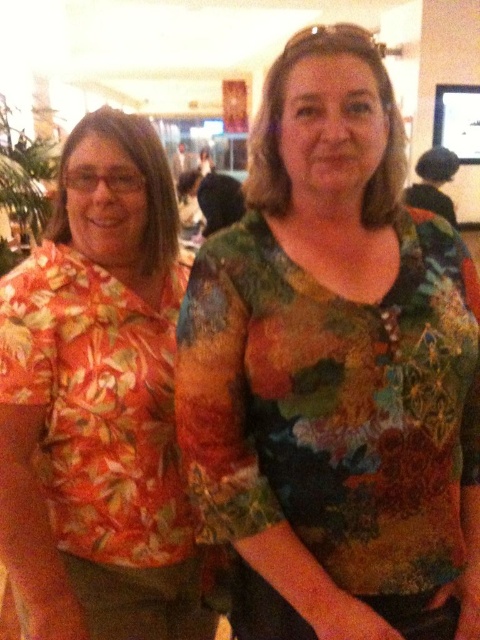
Question: Does floral fabric blouse at center come behind orange floral shirt at left?

Choices:
 (A) no
 (B) yes

Answer: (A)

Question: Is floral fabric blouse at center closer to camera compared to orange floral shirt at left?

Choices:
 (A) no
 (B) yes

Answer: (B)

Question: Among these objects, which one is farthest from the camera?

Choices:
 (A) floral fabric blouse at center
 (B) orange floral shirt at left

Answer: (B)

Question: Which point is closer to the camera?

Choices:
 (A) (290, 275)
 (B) (86, 312)

Answer: (A)

Question: Can you confirm if floral fabric blouse at center is wider than orange floral shirt at left?

Choices:
 (A) no
 (B) yes

Answer: (B)